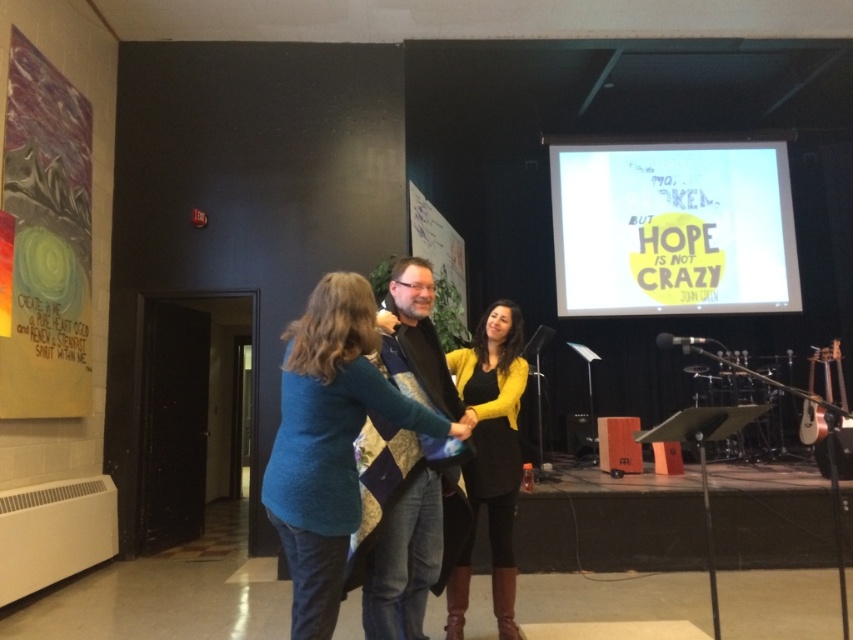
Is quilted fabric vest at center closer to camera compared to yellow knit cardigan at center?

That is True.

Which is behind, point (439, 564) or point (467, 369)?

Point (467, 369)

This screenshot has height=640, width=853. Identify the location of quilted fabric vest at center. (410, 554).

Measure the distance from white paper at upper center to quilted fabric vest at center.

They are 4.74 meters apart.

Between point (656, 164) and point (440, 545), which one is positioned behind?

Positioned behind is point (656, 164).

At what (x,y) coordinates should I click in order to perform the action: click on white paper at upper center. Please return your answer as a coordinate pair (x, y). Looking at the image, I should click on (672, 228).

Is white paper at upper center to the left of yellow knit cardigan at center from the viewer's perspective?

In fact, white paper at upper center is to the right of yellow knit cardigan at center.

Is white paper at upper center wider than yellow knit cardigan at center?

Yes, white paper at upper center is wider than yellow knit cardigan at center.

This screenshot has width=853, height=640. I want to click on white paper at upper center, so (672, 228).